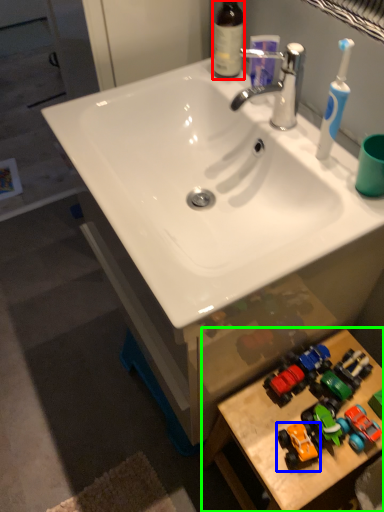
Question: Based on their relative distances, which object is farther from bottle (highlighted by a red box)? Choose from toy (highlighted by a blue box) and table (highlighted by a green box).

Choices:
 (A) toy
 (B) table

Answer: (A)